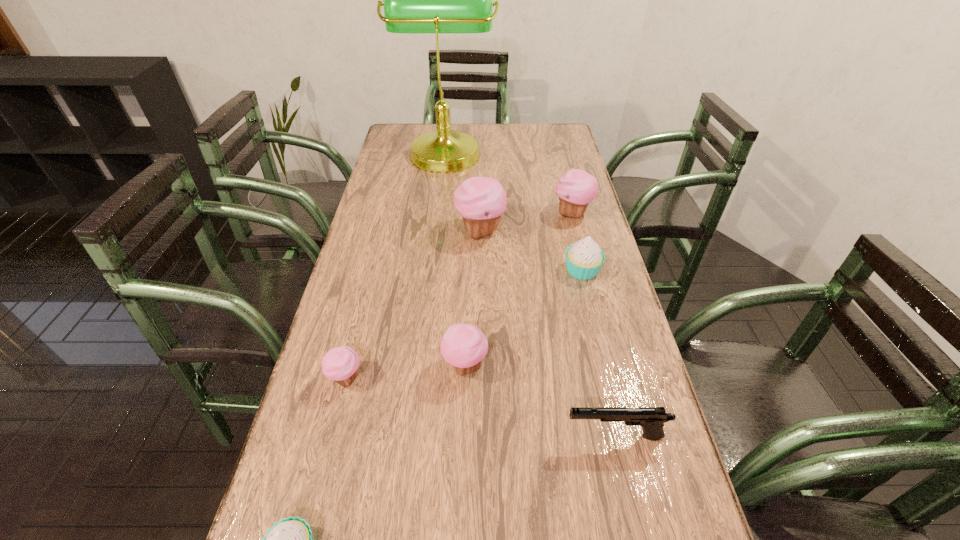
Identify which pink cupcake is the third closest to the gun. Please provide its 2D coordinates. Your answer should be formatted as a tuple, i.e. [(x, y)], where the tuple contains the x and y coordinates of a point satisfying the conditions above.

[(481, 201)]

What are the coordinates of `the third closest pink cupcake to the nearest object` in the screenshot? It's located at (481, 201).

The image size is (960, 540). Identify the location of vacant region that satisfies the following two spatial constraints: 1. on the desk next to the green lamp; 2. on the back side of the third tallest object. (439, 213).